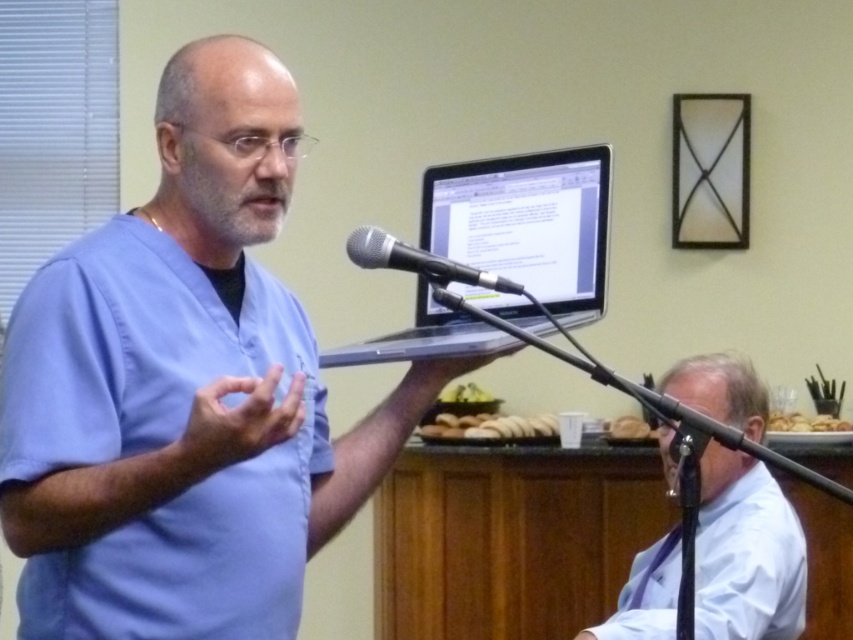
Question: Among these objects, which one is nearest to the camera?

Choices:
 (A) golden brown crumbly bread at right
 (B) white glossy shirt at lower right
 (C) black metallic microphone at center
 (D) blue scrubs at center

Answer: (D)

Question: Can you confirm if white glossy shirt at lower right is wider than golden brown crumbly bread at right?

Choices:
 (A) yes
 (B) no

Answer: (A)

Question: Which point is farther to the camera?

Choices:
 (A) (469, 381)
 (B) (271, 570)
 (C) (486, 420)
 (D) (753, 385)

Answer: (A)

Question: Is black metallic microphone at center thinner than golden brown croissant at center?

Choices:
 (A) no
 (B) yes

Answer: (B)

Question: Which point is farther to the camera?

Choices:
 (A) golden brown croissant at center
 (B) silver metallic laptop at upper center
 (C) black metallic microphone at center
 (D) yellow matte apples at center

Answer: (D)

Question: From the image, what is the correct spatial relationship of blue scrubs at center in relation to golden brown crumbly bread at right?

Choices:
 (A) left
 (B) right

Answer: (A)